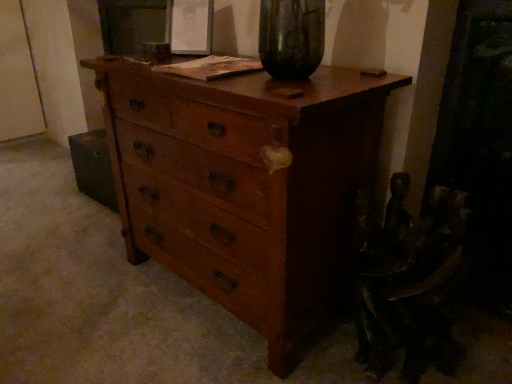
Question: Should I look upward or downward to see wooden swivel chair at lower right?

Choices:
 (A) down
 (B) up

Answer: (A)

Question: Is wooden swivel chair at lower right smaller than wooden chest of drawers at center?

Choices:
 (A) no
 (B) yes

Answer: (B)

Question: Is wooden swivel chair at lower right to the right of wooden chest of drawers at center from the viewer's perspective?

Choices:
 (A) no
 (B) yes

Answer: (B)

Question: From a real-world perspective, is wooden swivel chair at lower right on wooden chest of drawers at center?

Choices:
 (A) yes
 (B) no

Answer: (B)

Question: From the image's perspective, would you say wooden swivel chair at lower right is positioned over wooden chest of drawers at center?

Choices:
 (A) no
 (B) yes

Answer: (A)

Question: Considering the relative sizes of wooden swivel chair at lower right and wooden chest of drawers at center in the image provided, is wooden swivel chair at lower right wider than wooden chest of drawers at center?

Choices:
 (A) no
 (B) yes

Answer: (A)

Question: Is wooden swivel chair at lower right turned away from wooden chest of drawers at center?

Choices:
 (A) no
 (B) yes

Answer: (A)

Question: From the image's perspective, is wooden chest of drawers at center above wooden swivel chair at lower right?

Choices:
 (A) no
 (B) yes

Answer: (B)

Question: Does wooden chest of drawers at center have a greater height compared to wooden swivel chair at lower right?

Choices:
 (A) yes
 (B) no

Answer: (A)

Question: Is wooden swivel chair at lower right surrounded by wooden chest of drawers at center?

Choices:
 (A) no
 (B) yes

Answer: (A)

Question: From a real-world perspective, is wooden chest of drawers at center under wooden swivel chair at lower right?

Choices:
 (A) yes
 (B) no

Answer: (B)

Question: Could you tell me if wooden chest of drawers at center is turned towards wooden swivel chair at lower right?

Choices:
 (A) yes
 (B) no

Answer: (B)

Question: Can you confirm if wooden chest of drawers at center is positioned to the left of wooden swivel chair at lower right?

Choices:
 (A) no
 (B) yes

Answer: (B)

Question: Considering the positions of wooden swivel chair at lower right and wooden chest of drawers at center in the image, is wooden swivel chair at lower right bigger or smaller than wooden chest of drawers at center?

Choices:
 (A) big
 (B) small

Answer: (B)